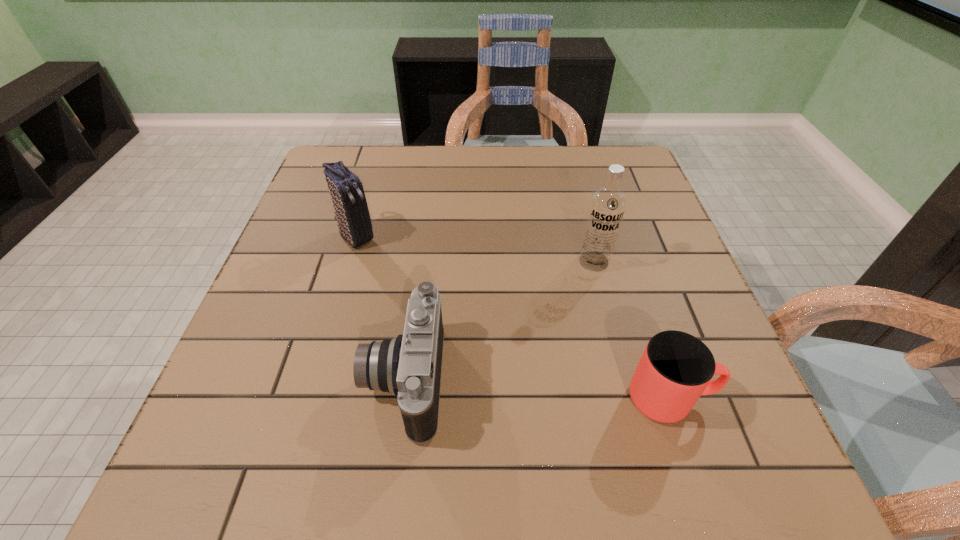
The height and width of the screenshot is (540, 960). I want to click on the third object from right to left, so click(409, 366).

The image size is (960, 540). Identify the location of the third tallest object. (409, 366).

The width and height of the screenshot is (960, 540). Find the location of `the shortest object`. the shortest object is located at coordinates (676, 368).

Where is `vodka`? The height and width of the screenshot is (540, 960). vodka is located at coordinates (607, 206).

Image resolution: width=960 pixels, height=540 pixels. What are the coordinates of `the third shortest object` in the screenshot? It's located at (347, 193).

Where is `the leftmost object`? This screenshot has height=540, width=960. the leftmost object is located at coordinates (347, 193).

You are a GUI agent. You are given a task and a screenshot of the screen. Output one action in this format:
    pyautogui.click(x=<x>, y=<y>)
    Task: Click on the vacant space positioned 0.130m on the front-facing side of the second shortest object
    The width and height of the screenshot is (960, 540).
    Given the screenshot: What is the action you would take?
    pyautogui.click(x=294, y=380)

The image size is (960, 540). What are the coordinates of `vacant region located on the front-facing side of the second shortest object` in the screenshot? It's located at (322, 380).

At what (x,y) coordinates should I click in order to perform the action: click on free space located 0.100m on the front-facing side of the second shortest object. Please return your answer as a coordinate pair (x, y). The image size is (960, 540). Looking at the image, I should click on (310, 380).

This screenshot has width=960, height=540. I want to click on vacant region located 0.060m on the handle side of the cup, so click(748, 399).